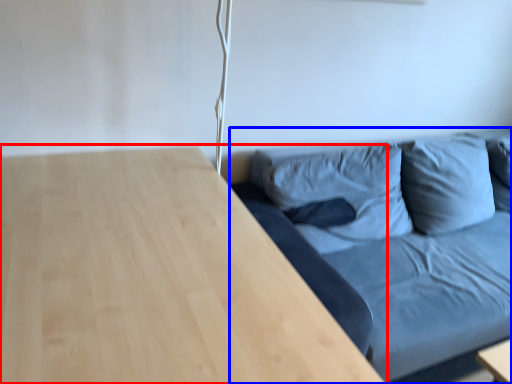
Question: Which point is closer to the camera, table (highlighted by a red box) or studio couch (highlighted by a blue box)?

Choices:
 (A) table
 (B) studio couch

Answer: (A)